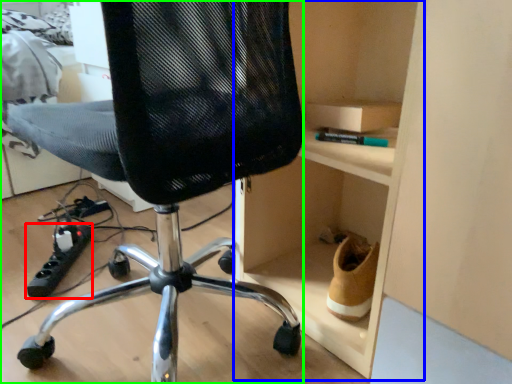
Question: Which object is the farthest from equipment (highlighted by a red box)? Choose among these: cabinet (highlighted by a blue box) or chair (highlighted by a green box).

Choices:
 (A) cabinet
 (B) chair

Answer: (A)